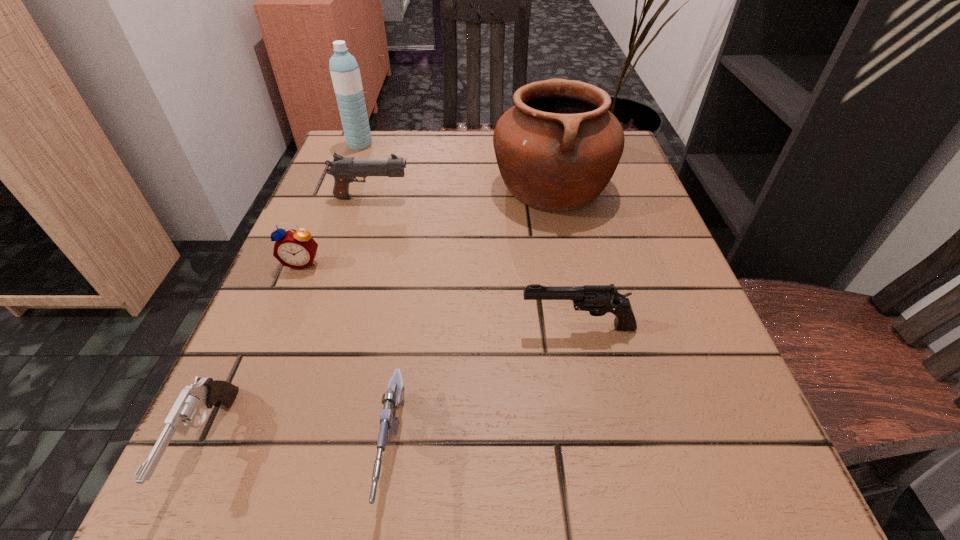
Select which object appears as the fourth closest to the third gun from left to right. Please provide its 2D coordinates. Your answer should be formatted as a tuple, i.e. [(x, y)], where the tuple contains the x and y coordinates of a point satisfying the conditions above.

[(557, 149)]

The height and width of the screenshot is (540, 960). What are the coordinates of `the second closest gun relative to the third object from right to left` in the screenshot? It's located at (205, 393).

Locate an element on the screen. gun that is the second closest to the leftmost gun is located at coordinates (597, 299).

Image resolution: width=960 pixels, height=540 pixels. I want to click on vacant area that satisfies the following two spatial constraints: 1. on the front side of the pottery; 2. in the direction the farthest gun is aimed, so click(554, 198).

You are a GUI agent. You are given a task and a screenshot of the screen. Output one action in this format:
    pyautogui.click(x=<x>, y=<y>)
    Task: Click on the free space that satisfies the following two spatial constraints: 1. on the front side of the farthest object; 2. on the right side of the pottery
    
    Given the screenshot: What is the action you would take?
    pyautogui.click(x=344, y=186)